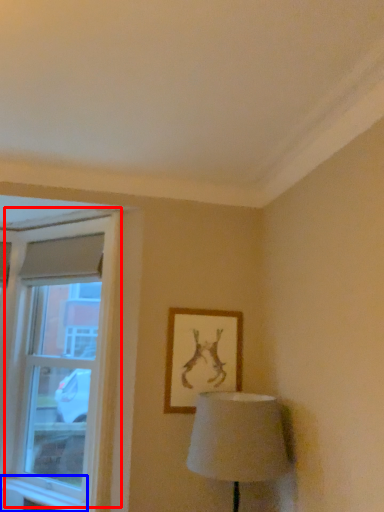
Question: Which point is further to the camera, window (highlighted by a red box) or window sill (highlighted by a blue box)?

Choices:
 (A) window
 (B) window sill

Answer: (A)